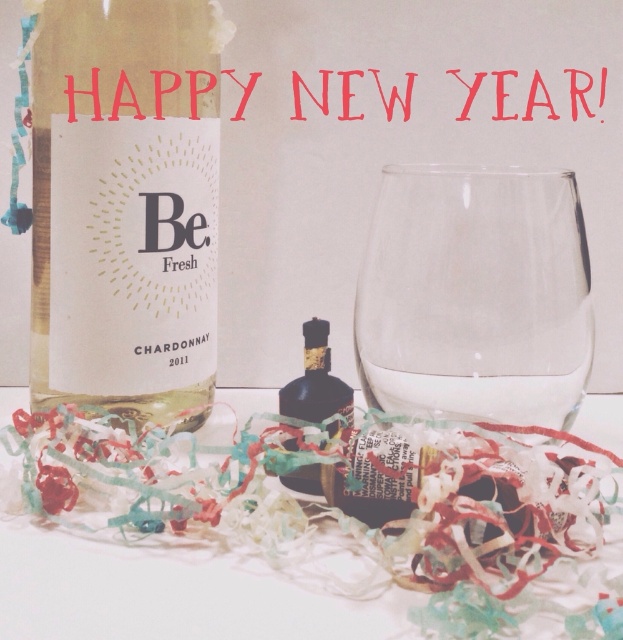
Who is taller, transparent glass at center or shiny dark glass bottle at center?

transparent glass at center

Does point (583, 355) come in front of point (330, 406)?

Yes.

At what (x,y) coordinates should I click in order to perform the action: click on transparent glass at center. Please return your answer as a coordinate pair (x, y). Image resolution: width=623 pixels, height=640 pixels. Looking at the image, I should click on (475, 296).

Which is more to the left, transparent glass at center or white paper at center?

From the viewer's perspective, white paper at center appears more on the left side.

Based on the photo, can you confirm if transparent glass at center is thinner than white paper at center?

Correct, transparent glass at center's width is less than white paper at center's.

Is point (492, 205) more distant than point (176, 547)?

Yes.

This screenshot has width=623, height=640. I want to click on transparent glass at center, so click(475, 296).

Does white paper at center have a greater width compared to shiny dark glass bottle at center?

Indeed, white paper at center has a greater width compared to shiny dark glass bottle at center.

Can you confirm if white paper at center is thinner than shiny dark glass bottle at center?

In fact, white paper at center might be wider than shiny dark glass bottle at center.

Image resolution: width=623 pixels, height=640 pixels. Find the location of `white paper at center`. white paper at center is located at coordinates (168, 589).